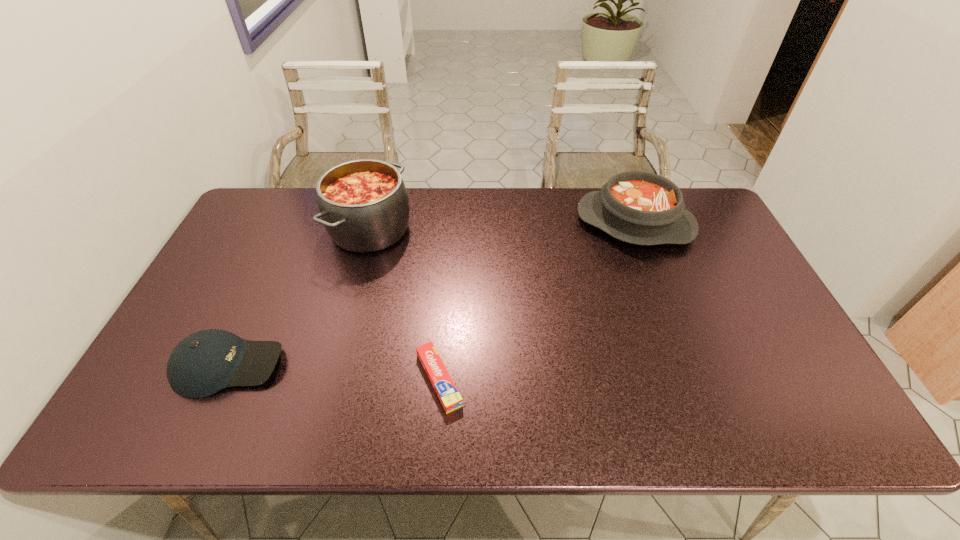
Find the location of a particular element. The image size is (960, 540). the closest object to the taller casserole is located at coordinates (205, 362).

At what (x,y) coordinates should I click in order to perform the action: click on object that is the third nearest to the right casserole. Please return your answer as a coordinate pair (x, y). Looking at the image, I should click on (205, 362).

Locate an element on the screen. vacant space that satisfies the following two spatial constraints: 1. on the front-facing side of the second object from right to left; 2. on the right side of the third tallest object is located at coordinates (223, 380).

The width and height of the screenshot is (960, 540). What are the coordinates of `free region that satisfies the following two spatial constraints: 1. on the front-facing side of the third tallest object; 2. on the back side of the second object from right to left` in the screenshot? It's located at (223, 380).

At what (x,y) coordinates should I click in order to perform the action: click on blank space that satisfies the following two spatial constraints: 1. on the front-facing side of the shortest object; 2. on the right side of the baseball cap. Please return your answer as a coordinate pair (x, y). Image resolution: width=960 pixels, height=540 pixels. Looking at the image, I should click on (223, 380).

Where is `vacant position in the image that satisfies the following two spatial constraints: 1. on the back side of the third shortest object; 2. on the left side of the tallest object`? The width and height of the screenshot is (960, 540). vacant position in the image that satisfies the following two spatial constraints: 1. on the back side of the third shortest object; 2. on the left side of the tallest object is located at coordinates coord(372,223).

You are a GUI agent. You are given a task and a screenshot of the screen. Output one action in this format:
    pyautogui.click(x=<x>, y=<y>)
    Task: Click on the vacant position in the image that satisfies the following two spatial constraints: 1. on the front side of the shorter casserole; 2. on the front-facing side of the baseball cap
    
    Given the screenshot: What is the action you would take?
    pyautogui.click(x=689, y=366)